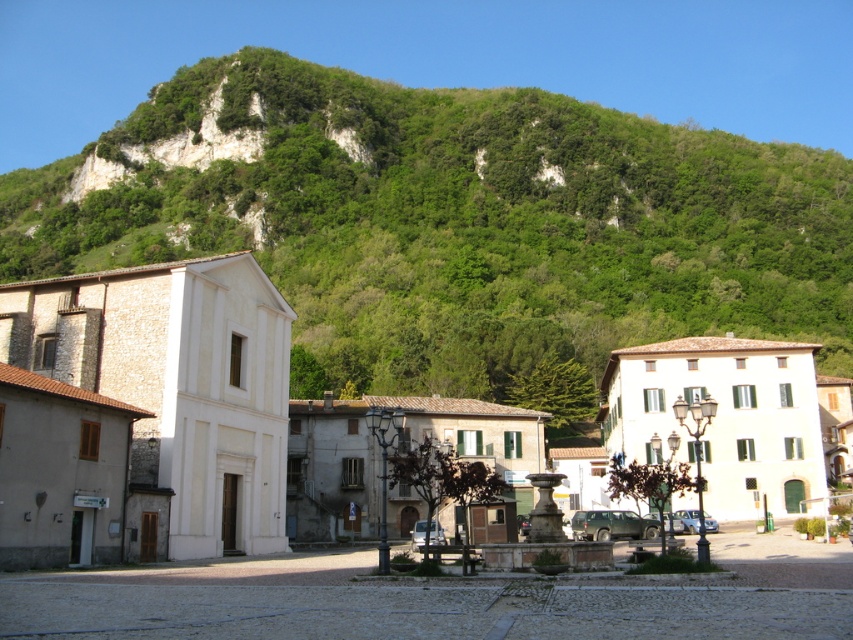
Question: Does green leafy hillside at upper center appear under white stone building at center?

Choices:
 (A) yes
 (B) no

Answer: (B)

Question: Is the position of green leafy hillside at upper center more distant than that of white stone building at center?

Choices:
 (A) no
 (B) yes

Answer: (B)

Question: Among these points, which one is farthest from the camera?

Choices:
 (A) (213, 225)
 (B) (135, 374)

Answer: (A)

Question: Is green leafy hillside at upper center wider than white stone building at center?

Choices:
 (A) yes
 (B) no

Answer: (A)